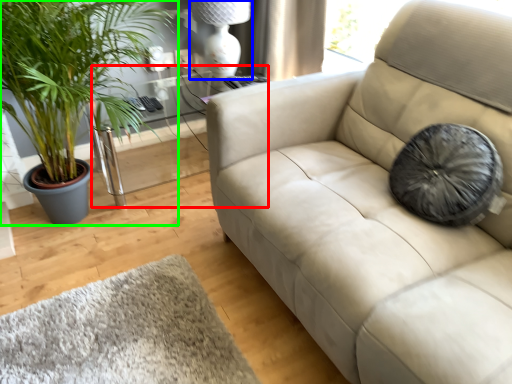
Question: Estimate the real-world distances between objects in this image. Which object is farther from table (highlighted by a red box), lamp (highlighted by a blue box) or houseplant (highlighted by a green box)?

Choices:
 (A) lamp
 (B) houseplant

Answer: (B)